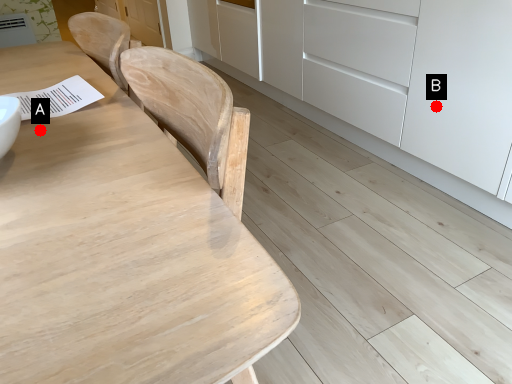
Question: Two points are circled on the image, labeled by A and B beside each circle. Which point is closer to the camera?

Choices:
 (A) A is closer
 (B) B is closer

Answer: (A)